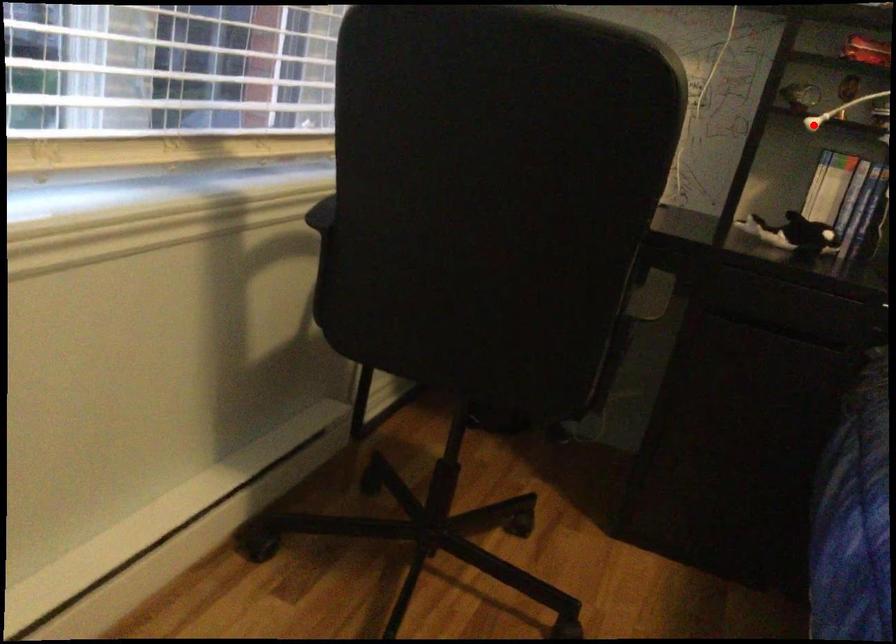
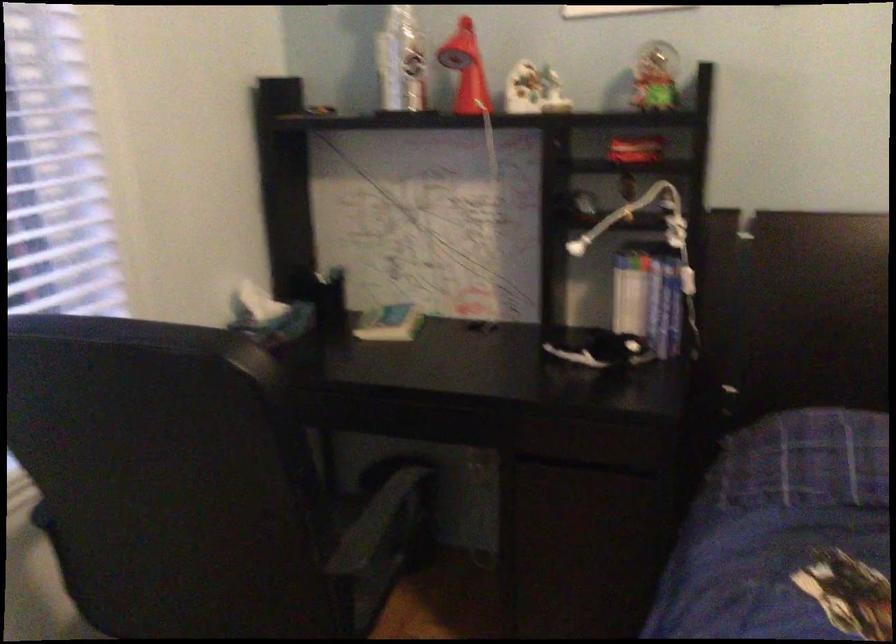
In the second image, find the point that corresponds to the highlighted location in the first image.

(576, 247)